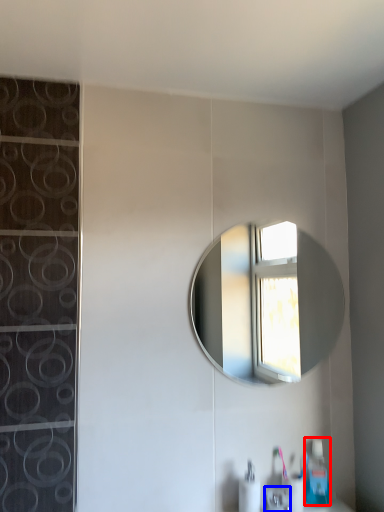
Question: Among these objects, which one is farthest to the camera, soap dispenser (highlighted by a red box) or faucet (highlighted by a blue box)?

Choices:
 (A) soap dispenser
 (B) faucet

Answer: (A)